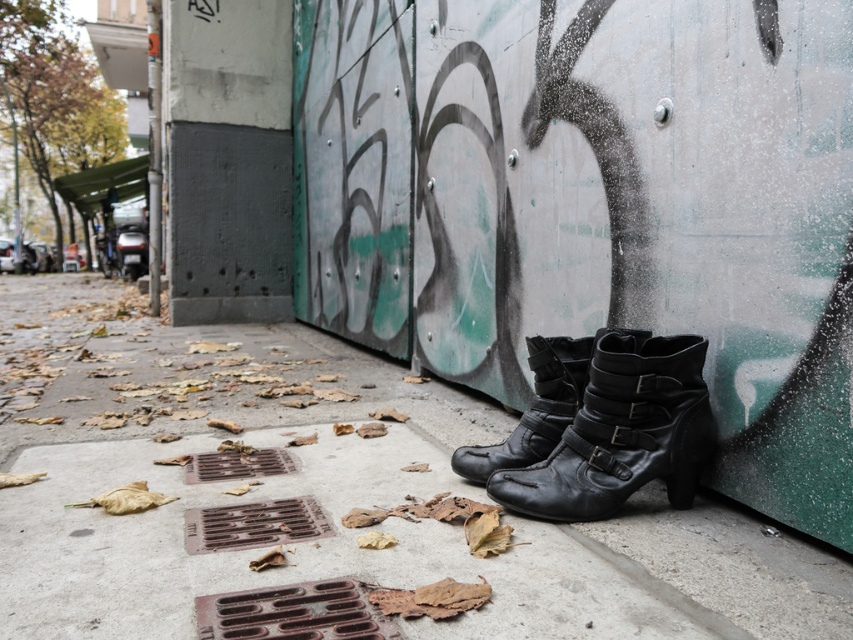
Measure the distance between black leather boots at lower right and camera.

They are 1.76 meters apart.

Consider the image. Can you confirm if black leather boots at lower right is positioned below black leather boots at center?

Yes.

Is point (248, 396) positioned in front of point (509, 445)?

No.

Where is `black leather boots at lower right`? This screenshot has height=640, width=853. black leather boots at lower right is located at coordinates (225, 390).

Is black leather boots at lower right thinner than black leather boot at lower right?

No, black leather boots at lower right is not thinner than black leather boot at lower right.

Is black leather boots at lower right smaller than black leather boot at lower right?

Incorrect, black leather boots at lower right is not smaller in size than black leather boot at lower right.

Which is in front, point (379, 579) or point (578, 483)?

Positioned in front is point (379, 579).

Where is `black leather boots at lower right`? The height and width of the screenshot is (640, 853). black leather boots at lower right is located at coordinates (225, 390).

Between black leather boot at lower right and black leather boots at center, which one has less height?

black leather boots at center

Which is in front, point (491, 474) or point (535, 410)?

Point (491, 474)

The image size is (853, 640). What are the coordinates of `black leather boot at lower right` in the screenshot? It's located at (622, 432).